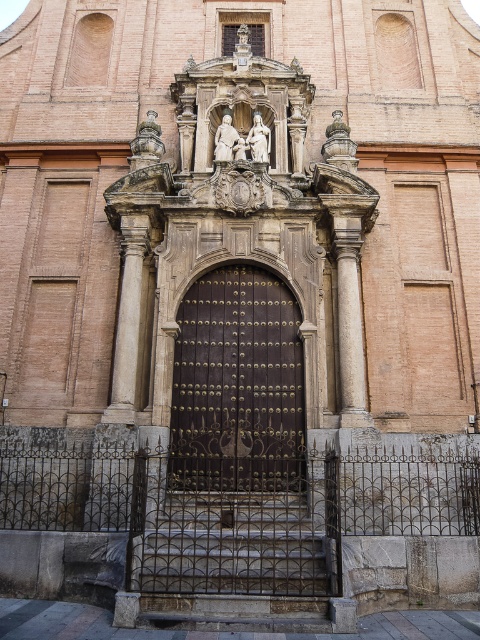
Question: Among these points, which one is nearest to the camera?

Choices:
 (A) (192, 312)
 (B) (248, 145)
 (C) (228, 154)

Answer: (A)

Question: Is matte stone statue at center positioned at the back of white marble statue at center?

Choices:
 (A) no
 (B) yes

Answer: (A)

Question: Which of these objects is positioned farthest from the dark brown wrought iron gate at center?

Choices:
 (A) white marble statue at center
 (B) matte stone statue at center

Answer: (A)

Question: Observing the image, what is the correct spatial positioning of dark brown wrought iron gate at center in reference to white marble statue at center?

Choices:
 (A) right
 (B) left

Answer: (A)

Question: Which of the following is the farthest from the observer?

Choices:
 (A) white marble statue at center
 (B) matte stone statue at center
 (C) dark brown wrought iron gate at center

Answer: (A)

Question: Does matte stone statue at center appear over white marble statue at center?

Choices:
 (A) yes
 (B) no

Answer: (B)